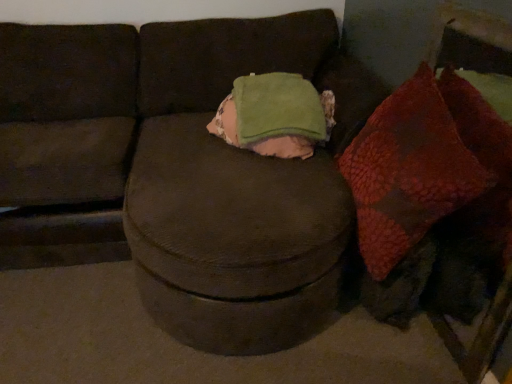
Question: Is leather-like brown dog at lower right situated inside textured red bean bag at right or outside?

Choices:
 (A) inside
 (B) outside

Answer: (A)

Question: From the image's perspective, is leather-like brown dog at lower right positioned above or below textured red bean bag at right?

Choices:
 (A) below
 (B) above

Answer: (A)

Question: Which is farther from the brown fabric couch at center?

Choices:
 (A) green fleece throw pillow at center
 (B) textured red bean bag at right
 (C) leather-like brown dog at lower right

Answer: (C)

Question: Which is nearer to the leather-like brown dog at lower right?

Choices:
 (A) green fleece throw pillow at center
 (B) textured red bean bag at right
 (C) brown fabric couch at center

Answer: (B)